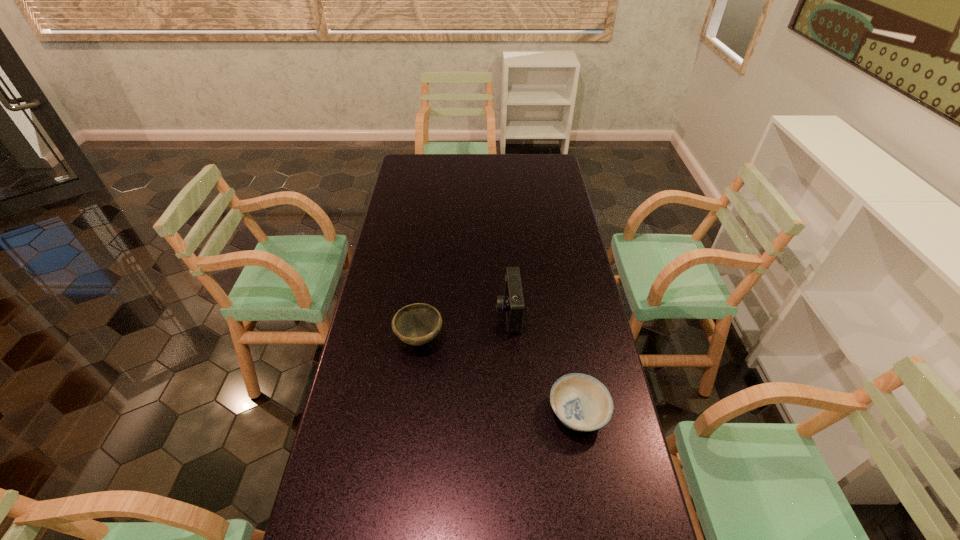
The width and height of the screenshot is (960, 540). I want to click on vacant space that satisfies the following two spatial constraints: 1. on the front-facing side of the camera; 2. on the right side of the right bowl, so click(515, 413).